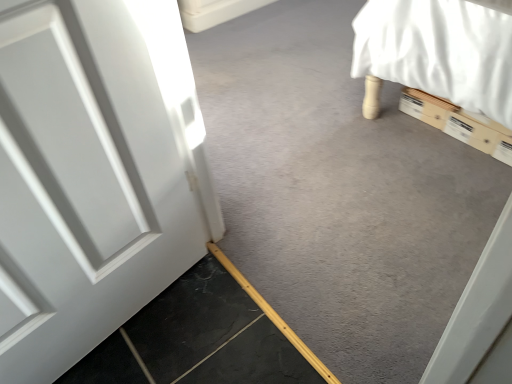
Where is `blank space situated above smooth gray concrete at bottom left, acting as the first concrete starting from the bottom (from a real-world perspective)`? This screenshot has height=384, width=512. blank space situated above smooth gray concrete at bottom left, acting as the first concrete starting from the bottom (from a real-world perspective) is located at coordinates (182, 339).